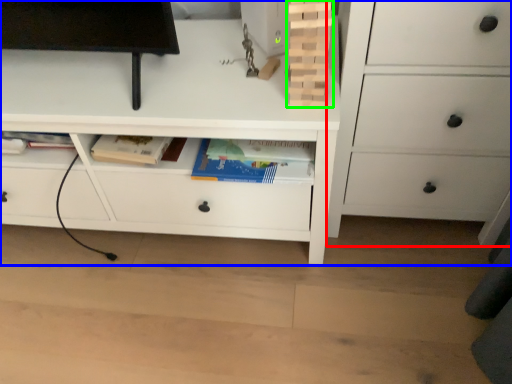
Question: Estimate the real-world distances between objects in this image. Which object is farther from chest of drawers (highlighted by a red box), chest of drawers (highlighted by a blue box) or book (highlighted by a green box)?

Choices:
 (A) chest of drawers
 (B) book

Answer: (B)